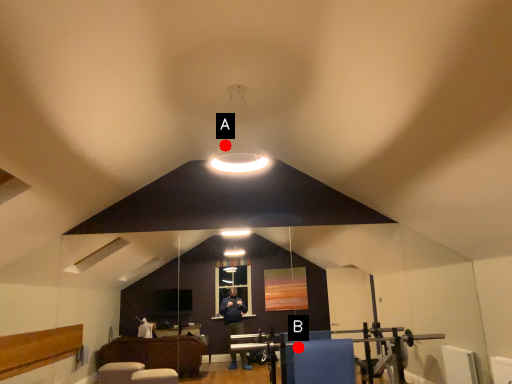
Question: Two points are circled on the image, labeled by A and B beside each circle. Which of the following is the closest to the observer?

Choices:
 (A) A is closer
 (B) B is closer

Answer: (B)